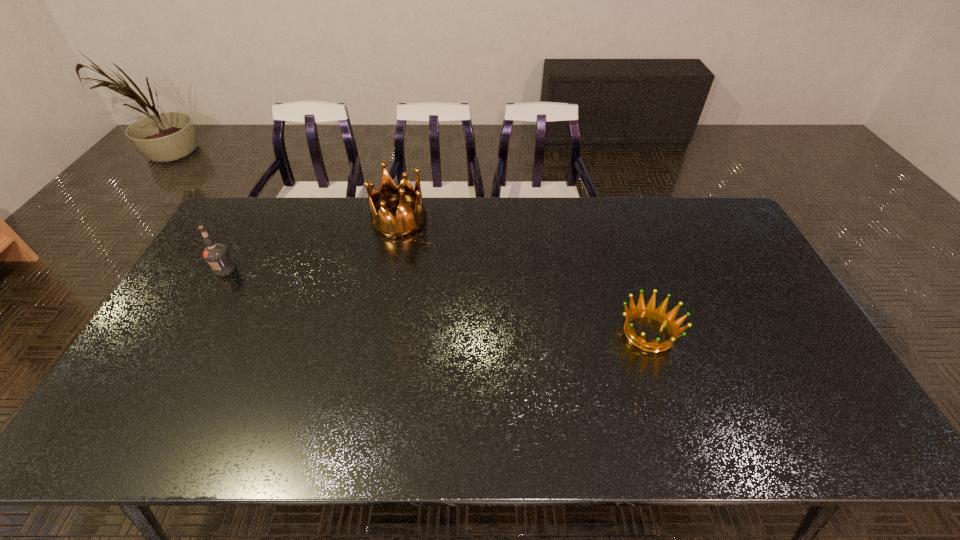
In order to click on object that is at the left edge in this screenshot , I will do `click(217, 256)`.

Where is `vacant space at the far edge of the desktop`? Image resolution: width=960 pixels, height=540 pixels. vacant space at the far edge of the desktop is located at coordinates (427, 201).

Find the location of a particular element. vacant region at the near edge of the desktop is located at coordinates (501, 416).

Find the location of a particular element. This screenshot has width=960, height=540. vacant area at the left edge is located at coordinates (164, 410).

I want to click on free spot at the far left corner of the desktop, so click(273, 221).

The width and height of the screenshot is (960, 540). I want to click on unoccupied area between the rightmost object and the second farthest object, so click(437, 301).

This screenshot has height=540, width=960. I want to click on free spot between the farther crown and the vodka, so click(x=312, y=245).

Identify the location of unoccupied area between the second nearest object and the farthest object. The image size is (960, 540). (312, 245).

The width and height of the screenshot is (960, 540). In order to click on free space between the leftmost object and the farther crown in this screenshot , I will do `click(312, 245)`.

This screenshot has width=960, height=540. I want to click on unoccupied position between the second farthest object and the farther crown, so [312, 245].